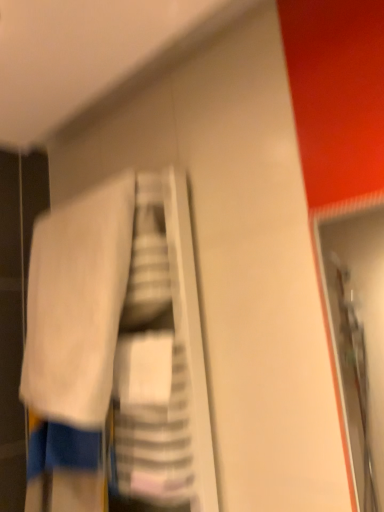
Question: From a real-world perspective, is white fabric at center positioned over white soft towel at upper left based on gravity?

Choices:
 (A) yes
 (B) no

Answer: (B)

Question: Does white fabric at center contain white soft towel at upper left?

Choices:
 (A) yes
 (B) no

Answer: (A)

Question: Considering the relative positions of white fabric at center and white soft towel at upper left in the image provided, is white fabric at center to the right of white soft towel at upper left from the viewer's perspective?

Choices:
 (A) yes
 (B) no

Answer: (A)

Question: From a real-world perspective, is white fabric at center physically below white soft towel at upper left?

Choices:
 (A) yes
 (B) no

Answer: (A)

Question: Does white fabric at center have a greater height compared to white soft towel at upper left?

Choices:
 (A) no
 (B) yes

Answer: (B)

Question: Is white fabric at center positioned behind white soft towel at upper left?

Choices:
 (A) no
 (B) yes

Answer: (A)

Question: From the image's perspective, does white soft towel at upper left appear lower than white fabric at center?

Choices:
 (A) yes
 (B) no

Answer: (B)

Question: From the image's perspective, is white soft towel at upper left on top of white fabric at center?

Choices:
 (A) yes
 (B) no

Answer: (A)

Question: From a real-world perspective, is white soft towel at upper left positioned under white fabric at center based on gravity?

Choices:
 (A) no
 (B) yes

Answer: (A)

Question: Does white soft towel at upper left have a lesser height compared to white fabric at center?

Choices:
 (A) no
 (B) yes

Answer: (B)

Question: Would you say white soft towel at upper left is outside white fabric at center?

Choices:
 (A) no
 (B) yes

Answer: (A)

Question: Is white soft towel at upper left directly adjacent to white fabric at center?

Choices:
 (A) yes
 (B) no

Answer: (A)

Question: From a real-world perspective, relative to white soft towel at upper left, is white fabric at center vertically above or below?

Choices:
 (A) below
 (B) above

Answer: (A)